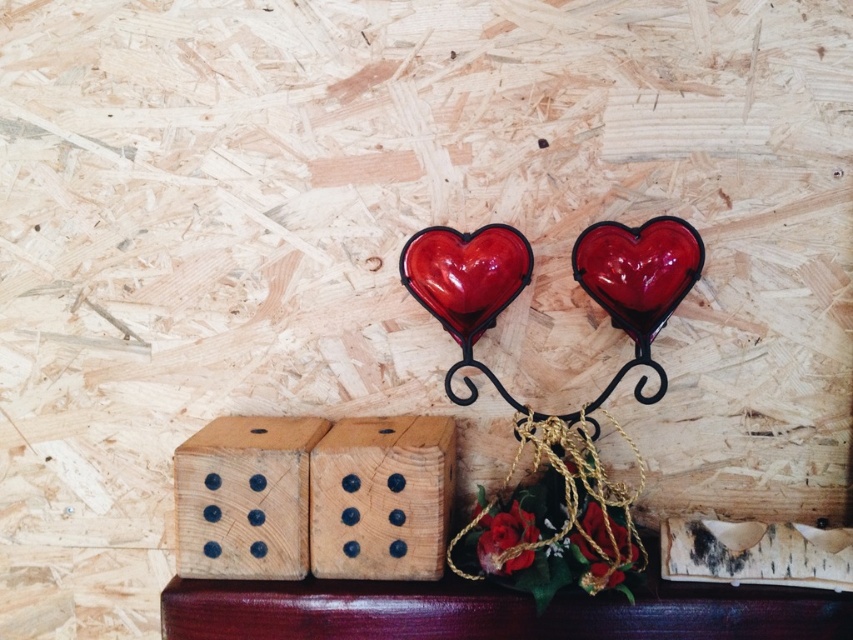
Question: Is wooden die at center positioned before gold metallic chain at center?

Choices:
 (A) no
 (B) yes

Answer: (A)

Question: Which point is closer to the camera?

Choices:
 (A) wooden die at center
 (B) gold metallic chain at center
 (C) black birch wood at lower right

Answer: (B)

Question: Can you confirm if wooden die at center is positioned above gold metallic chain at center?

Choices:
 (A) no
 (B) yes

Answer: (B)

Question: Which object appears farthest from the camera in this image?

Choices:
 (A) glossy glass heart at center
 (B) wooden die at center
 (C) natural wood domino at lower left
 (D) black birch wood at lower right

Answer: (A)

Question: Is wooden die at center above natural wood domino at lower left?

Choices:
 (A) no
 (B) yes

Answer: (A)

Question: Which object appears farthest from the camera in this image?

Choices:
 (A) natural wood domino at lower left
 (B) gold metallic chain at center
 (C) black birch wood at lower right

Answer: (A)